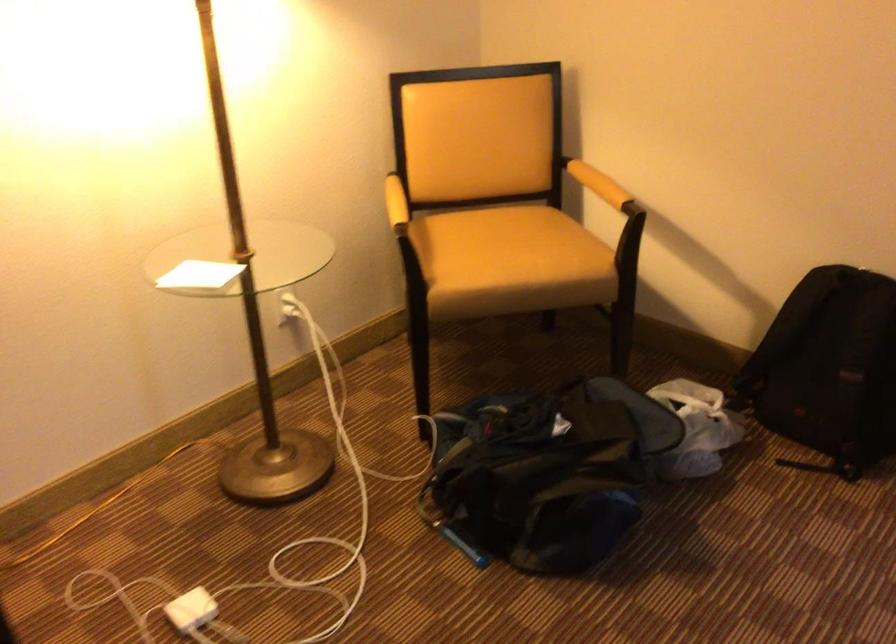
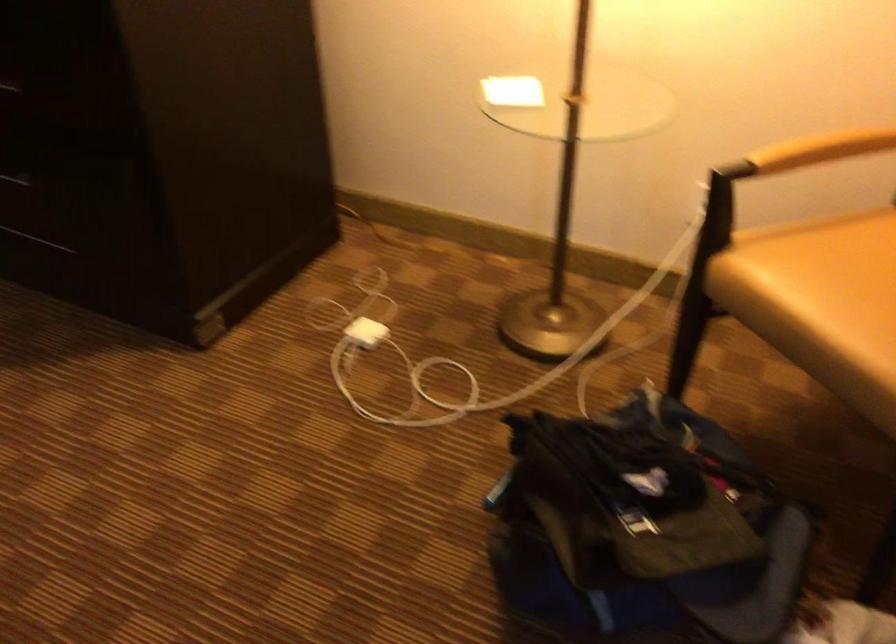
Locate, in the second image, the point that corresponds to the point at 395,203 in the first image.

(788, 140)